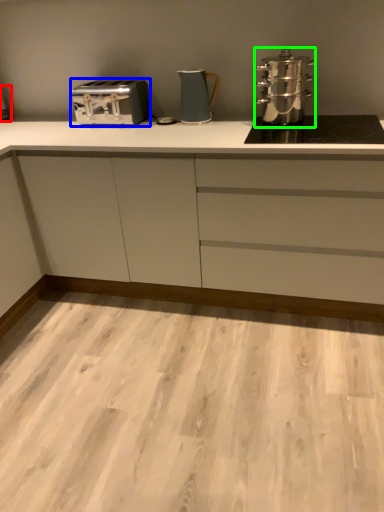
Question: Based on their relative distances, which object is nearer to appliance (highlighted by a red box)? Choose from toaster (highlighted by a blue box) and kitchen appliance (highlighted by a green box).

Choices:
 (A) toaster
 (B) kitchen appliance

Answer: (A)